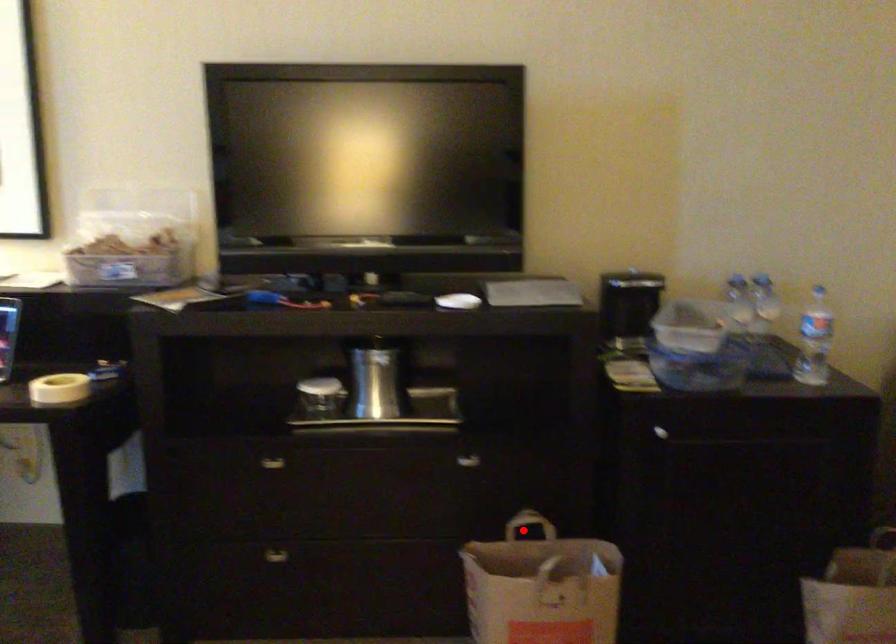
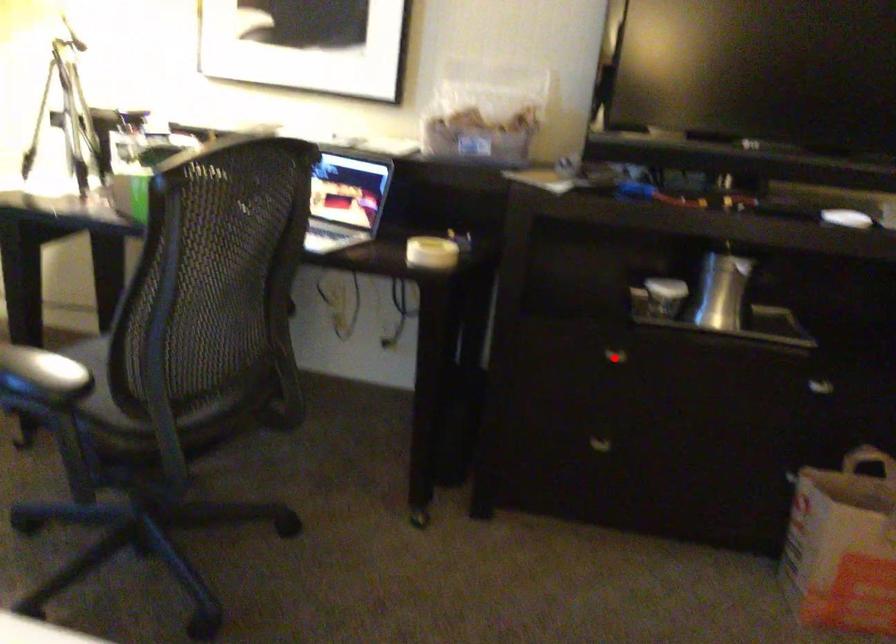
I am providing you with two images of the same scene from different viewpoints. A red point is marked on the first image and another point is marked on the second image. Are the points marked in image1 and image2 representing the same 3D position?

No